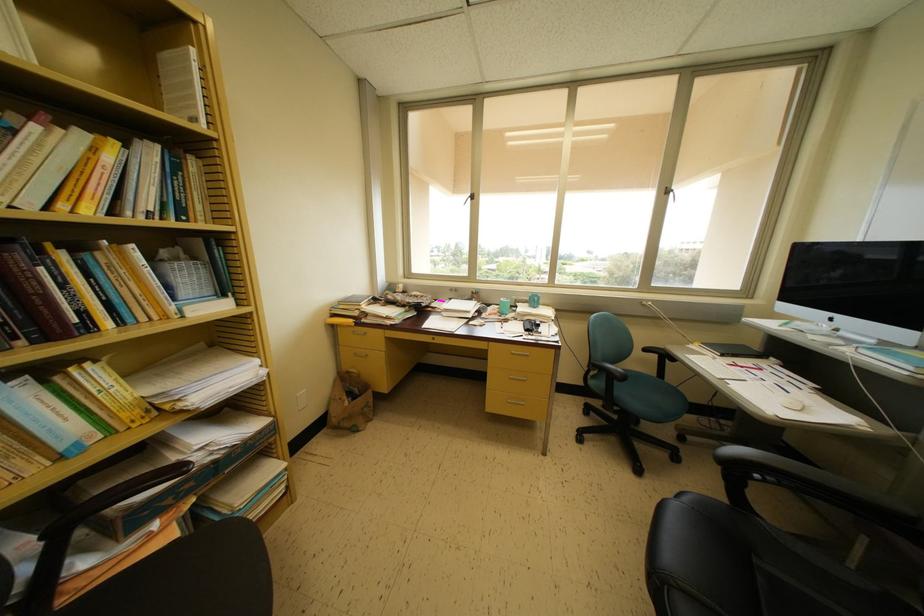
Identify the location of black window handle. This screenshot has height=616, width=924. (670, 193).